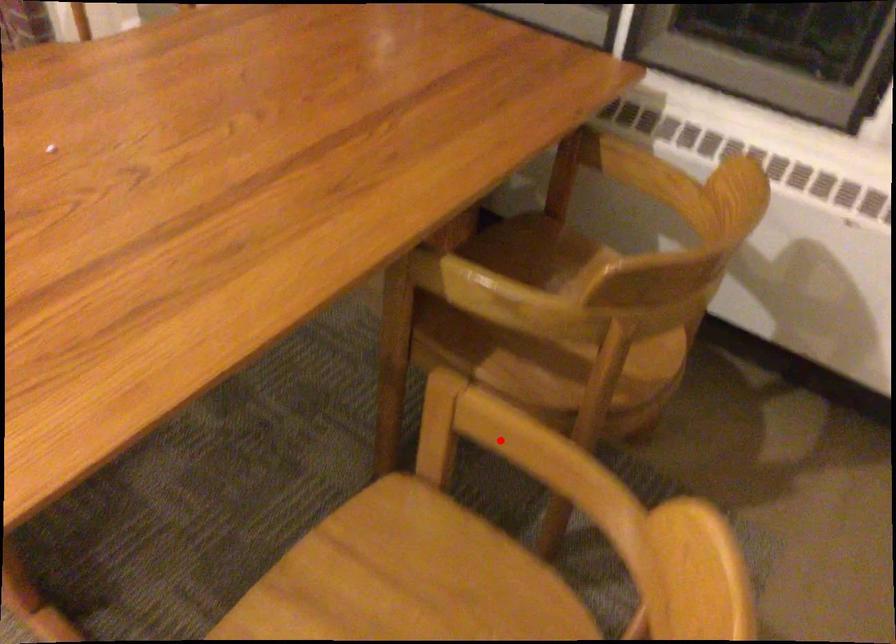
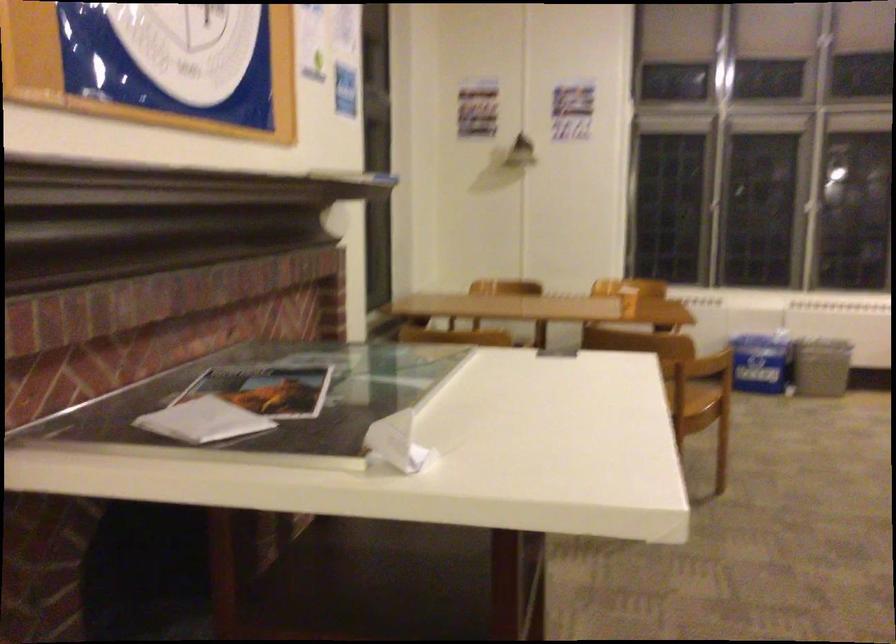
Question: I am providing you with two images of the same scene from different viewpoints. A red point is marked on the first image. Can you still see the location of the red point in image 2?

Choices:
 (A) Yes
 (B) No

Answer: (B)